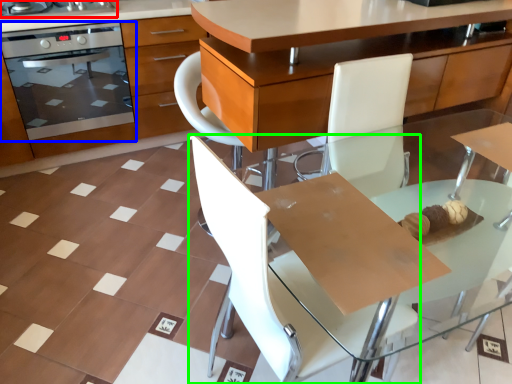
Question: Which is nearer to the home appliance (highlighted by a red box)? kitchen appliance (highlighted by a blue box) or chair (highlighted by a green box).

Choices:
 (A) kitchen appliance
 (B) chair

Answer: (A)